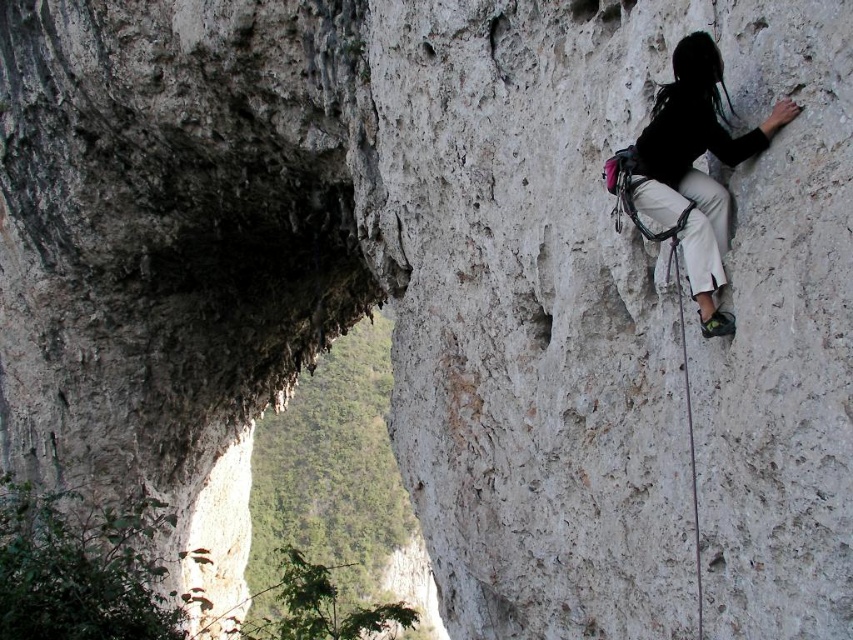
You are a safety inspector assessing the rock climber in the image. You notice the black fabric harness at right and the white nylon rope at right. Which of these two items is positioned higher on the climber?

The black fabric harness at right is much taller as white nylon rope at right, so the harness is higher up on the climber.

You are a rock climber assessing your gear setup. You notice the black fabric harness at right and the white nylon rope at right. Which item is closer to your viewpoint?

The black fabric harness at right is closer to your viewpoint because it is in front of the white nylon rope at right.

Looking at this image, what is the exact coordinate of the black fabric harness at right?

The black fabric harness at right is located at coordinate point (693, 168).